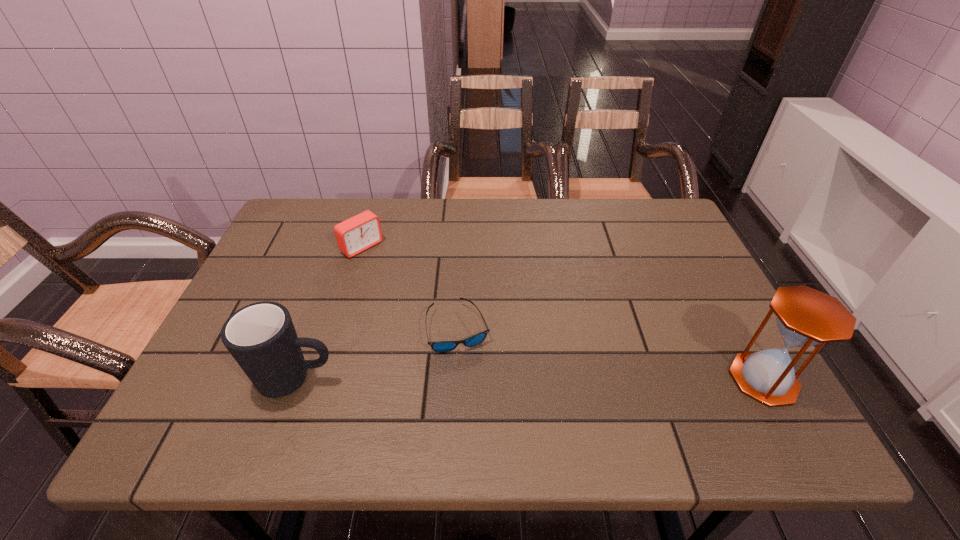
In order to click on mug in this screenshot , I will do `click(261, 337)`.

Find the location of a particular element. the rightmost object is located at coordinates (806, 317).

Where is `the tallest object`? the tallest object is located at coordinates (806, 317).

The width and height of the screenshot is (960, 540). Find the location of `the third object from left to right`. the third object from left to right is located at coordinates (440, 346).

At what (x,y) coordinates should I click in order to perform the action: click on sunglasses. Please return your answer as a coordinate pair (x, y). Image resolution: width=960 pixels, height=540 pixels. Looking at the image, I should click on (440, 346).

Locate an element on the screen. the farthest object is located at coordinates (358, 233).

Identify the location of the third tallest object. (358, 233).

In order to click on free spot located on the side of the second tallest object with the handle in this screenshot , I will do `click(452, 380)`.

Image resolution: width=960 pixels, height=540 pixels. I want to click on free space located 0.200m on the back of the rightmost object, so tap(714, 291).

Find the location of a particular element. free space located at the front of the sunglasses showing the lenses is located at coordinates point(525,373).